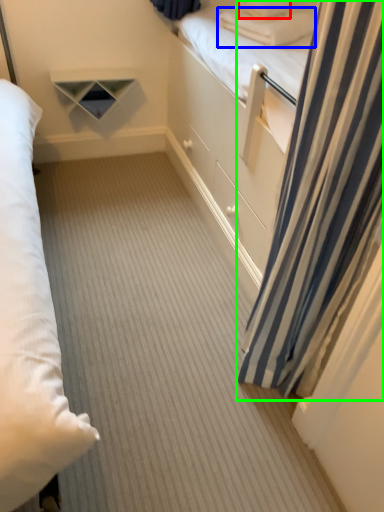
Question: Which object is positioned closest to pillow (highlighted by a red box)? Select from pillow (highlighted by a blue box) and curtain (highlighted by a green box).

Choices:
 (A) pillow
 (B) curtain

Answer: (A)